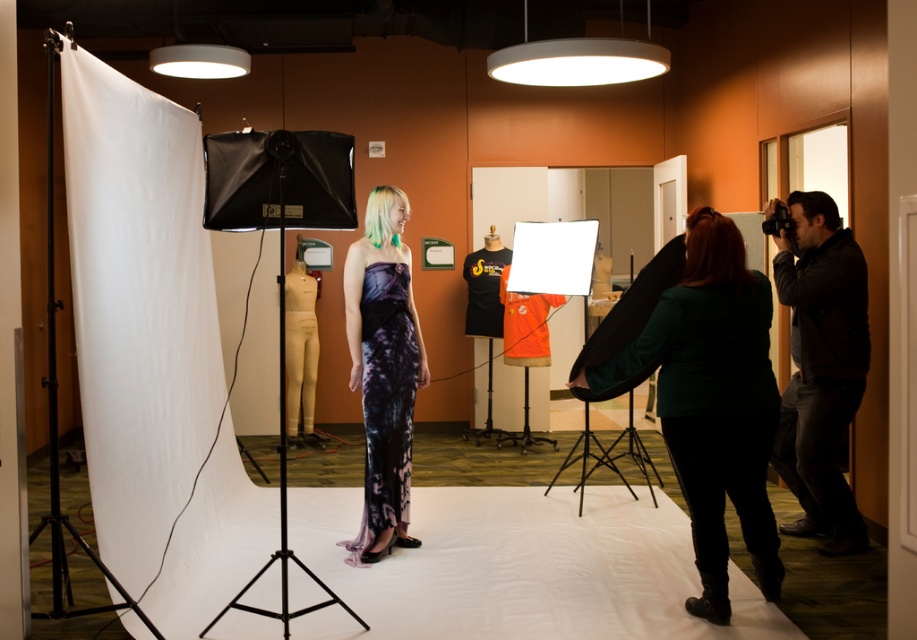
Question: Which of the following is the farthest from the observer?

Choices:
 (A) (843, 541)
 (B) (706, 515)

Answer: (A)

Question: Can you confirm if green matte jacket at right is bigger than purple tie-dye fabric dress at center?

Choices:
 (A) no
 (B) yes

Answer: (B)

Question: Which object is positioned farthest from the green matte jacket at right?

Choices:
 (A) purple tie-dye fabric dress at center
 (B) dark brown leather jacket at right

Answer: (A)

Question: Does green matte jacket at right appear over purple tie-dye fabric dress at center?

Choices:
 (A) no
 (B) yes

Answer: (A)

Question: Which object is farther from the camera taking this photo?

Choices:
 (A) dark brown leather jacket at right
 (B) purple tie-dye fabric dress at center
 (C) green matte jacket at right

Answer: (B)

Question: Is green matte jacket at right wider than purple tie-dye fabric dress at center?

Choices:
 (A) yes
 (B) no

Answer: (A)